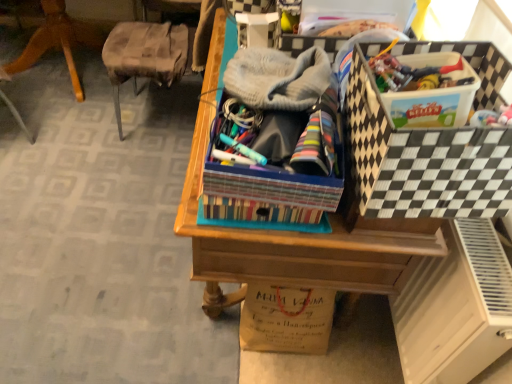
This screenshot has width=512, height=384. What do you see at coordinates (292, 234) in the screenshot? I see `wooden desk at center` at bounding box center [292, 234].

Locate an element on the screen. The width and height of the screenshot is (512, 384). wooden desk at center is located at coordinates [x=292, y=234].

Measure the distance between point (x=78, y=85) and camera.

Point (x=78, y=85) is 7.81 feet away from camera.

What do you see at coordinates (56, 41) in the screenshot?
I see `wooden chair at left` at bounding box center [56, 41].

What is the approximate height of black and white checkered storage box at upper right?

black and white checkered storage box at upper right is 9.14 inches tall.

Identify the location of brown paper bag at lower center. (286, 319).

Identify the location of desk below the black and white checkered storage box at upper right (from the image's perspective). (292, 234).

From the image's perspective, which object appears higher, black and white checkered storage box at upper right or wooden desk at center?

black and white checkered storage box at upper right is shown above in the image.

From a real-world perspective, is black and white checkered storage box at upper right positioned under wooden desk at center based on gravity?

No, from a real-world perspective, black and white checkered storage box at upper right is not below wooden desk at center.

Who is bigger, black and white checkered storage box at upper right or wooden desk at center?

Bigger between the two is wooden desk at center.

Is black and white checkered storage box at upper right with wooden chair at left?

No, black and white checkered storage box at upper right is not in contact with wooden chair at left.

Is black and white checkered storage box at upper right at the right side of wooden chair at left?

Indeed, black and white checkered storage box at upper right is positioned on the right side of wooden chair at left.

Which is farther, (472, 52) or (62, 35)?

Point (62, 35)

Considering the sizes of objects black and white checkered storage box at upper right and wooden chair at left in the image provided, who is smaller, black and white checkered storage box at upper right or wooden chair at left?

Smaller between the two is black and white checkered storage box at upper right.

From the image's perspective, between wooden chair at left and wooden desk at center, who is located below?

wooden desk at center is shown below in the image.

Are wooden chair at left and wooden desk at center making contact?

No, wooden chair at left is not making contact with wooden desk at center.

Considering the relative sizes of wooden chair at left and wooden desk at center in the image provided, is wooden chair at left thinner than wooden desk at center?

Correct, the width of wooden chair at left is less than that of wooden desk at center.

From a real-world perspective, is wooden chair at left under wooden desk at center?

Yes, from a real-world perspective, wooden chair at left is under wooden desk at center.

From the image's perspective, is brown paper bag at lower center located above or below white matte file cabinet at lower right?

Clearly, from the image's perspective, brown paper bag at lower center is below white matte file cabinet at lower right.

Is brown paper bag at lower center facing away from white matte file cabinet at lower right?

Yes, brown paper bag at lower center's orientation is away from white matte file cabinet at lower right.

Is brown paper bag at lower center not close to white matte file cabinet at lower right?

brown paper bag at lower center is near white matte file cabinet at lower right, not far away.

Considering the points (268, 295) and (437, 266), which point is in front, point (268, 295) or point (437, 266)?

Point (437, 266)

Who is smaller, white matte file cabinet at lower right or black and white checkered storage box at upper right?

black and white checkered storage box at upper right is smaller.

What's the angular difference between white matte file cabinet at lower right and black and white checkered storage box at upper right's facing directions?

There is a 4.82-degree angle between the facing directions of white matte file cabinet at lower right and black and white checkered storage box at upper right.

Does point (469, 303) appear closer or farther from the camera than point (478, 131)?

Point (469, 303) is positioned farther from the camera compared to point (478, 131).

Considering the relative sizes of white matte file cabinet at lower right and black and white checkered storage box at upper right in the image provided, is white matte file cabinet at lower right wider than black and white checkered storage box at upper right?

No, white matte file cabinet at lower right is not wider than black and white checkered storage box at upper right.

From a real-world perspective, between wooden desk at center and gray knitted hat at center, who is vertically lower?

A: In real-world perspective, wooden desk at center is lower.

What's the angular difference between wooden desk at center and gray knitted hat at center's facing directions?

wooden desk at center and gray knitted hat at center are facing 2.23 degrees away from each other.

Is wooden desk at center at the left side of gray knitted hat at center?

No, wooden desk at center is not to the left of gray knitted hat at center.

Is wooden desk at center aimed at gray knitted hat at center?

No, wooden desk at center is not aimed at gray knitted hat at center.

Between white matte file cabinet at lower right and brown paper bag at lower center, which one appears on the right side from the viewer's perspective?

white matte file cabinet at lower right is more to the right.

From a real-world perspective, relative to brown paper bag at lower center, is white matte file cabinet at lower right vertically above or below?

From a real-world perspective, white matte file cabinet at lower right is physically above brown paper bag at lower center.

Which is correct: white matte file cabinet at lower right is inside brown paper bag at lower center, or outside of it?

white matte file cabinet at lower right is not inside brown paper bag at lower center, it's outside.

This screenshot has width=512, height=384. In order to click on storage box above the wooden desk at center (from a real-world perspective) in this screenshot , I will do `click(420, 159)`.

Locate an element on the screen. storage box on the right of wooden chair at left is located at coordinates 420,159.

Estimate the real-world distances between objects in this image. Which object is closer to gray knitted hat at center, wooden chair at left or wooden desk at center?

Among the two, wooden desk at center is located nearer to gray knitted hat at center.

Which object lies nearer to the anchor point white matte file cabinet at lower right, brown paper bag at lower center or black and white checkered storage box at upper right?

black and white checkered storage box at upper right.

Looking at the image, which one is located closer to brown paper bag at lower center, white matte file cabinet at lower right or wooden desk at center?

wooden desk at center is closer to brown paper bag at lower center.

Based on their spatial positions, is wooden desk at center or white matte file cabinet at lower right further from wooden chair at left?

Among the two, white matte file cabinet at lower right is located further to wooden chair at left.

From the image, which object appears to be farther from brown paper bag at lower center, wooden desk at center or wooden chair at left?

The object further to brown paper bag at lower center is wooden chair at left.

Looking at the image, which one is located closer to brown paper bag at lower center, black and white checkered storage box at upper right or white matte file cabinet at lower right?

white matte file cabinet at lower right.

Considering their positions, is wooden desk at center positioned further to gray knitted hat at center than black and white checkered storage box at upper right?

wooden desk at center is positioned further to the anchor gray knitted hat at center.

From the image, which object appears to be nearer to gray knitted hat at center, wooden chair at left or white matte file cabinet at lower right?

white matte file cabinet at lower right is positioned closer to the anchor gray knitted hat at center.

What are the coordinates of `file cabinet that lies between gray knitted hat at center and brown paper bag at lower center from top to bottom` in the screenshot? It's located at (455, 307).

Where is `file cabinet located between black and white checkered storage box at upper right and brown paper bag at lower center in the depth direction`? The image size is (512, 384). file cabinet located between black and white checkered storage box at upper right and brown paper bag at lower center in the depth direction is located at coordinates (455, 307).

Identify the location of desk between gray knitted hat at center and brown paper bag at lower center in the up-down direction. This screenshot has height=384, width=512. (292, 234).

Find the location of a particular element. desk between gray knitted hat at center and white matte file cabinet at lower right in the vertical direction is located at coordinates point(292,234).